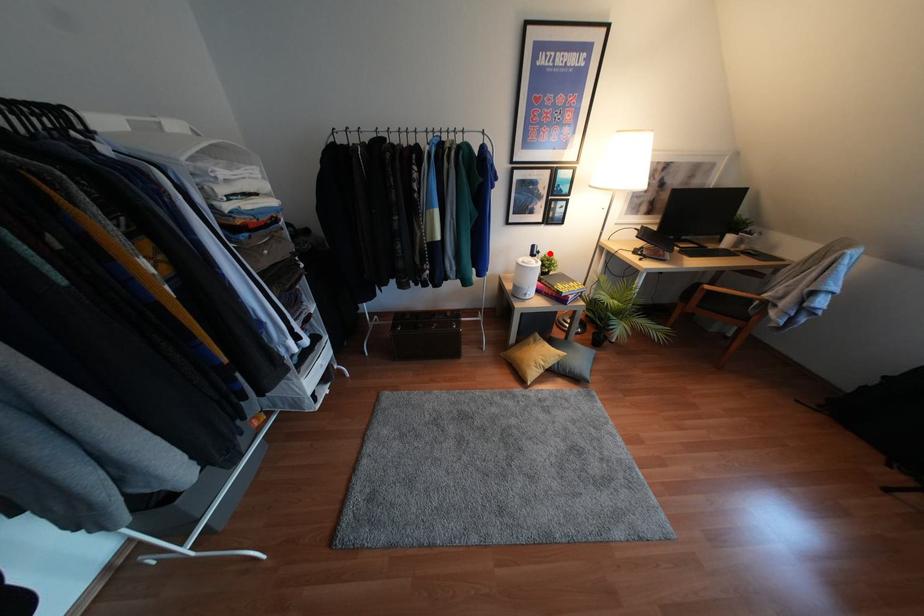
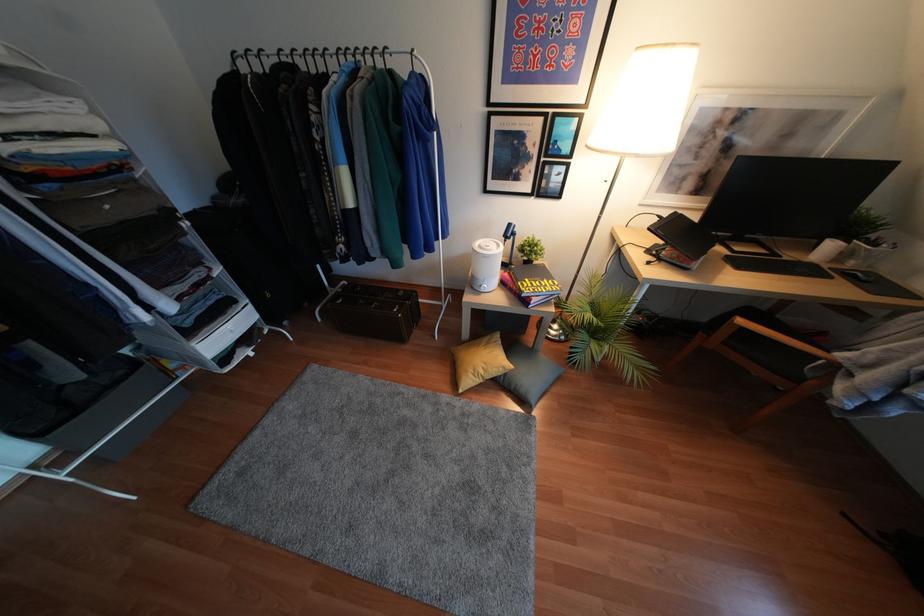
Locate, in the second image, the point that corresponds to the highlighted location in the first image.

(536, 237)